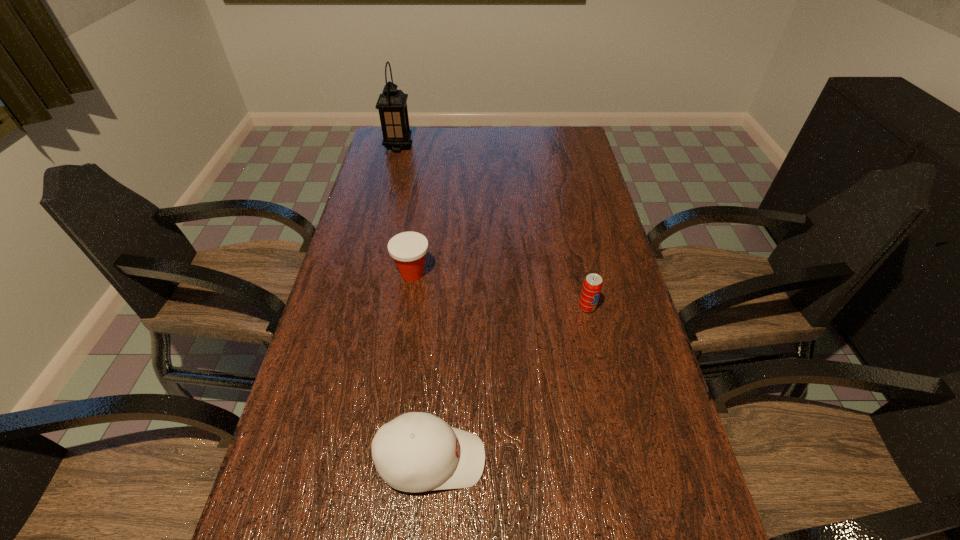
This screenshot has height=540, width=960. I want to click on free region that satisfies the following two spatial constraints: 1. on the front side of the soda can; 2. on the front-facing side of the baseball cap, so click(620, 460).